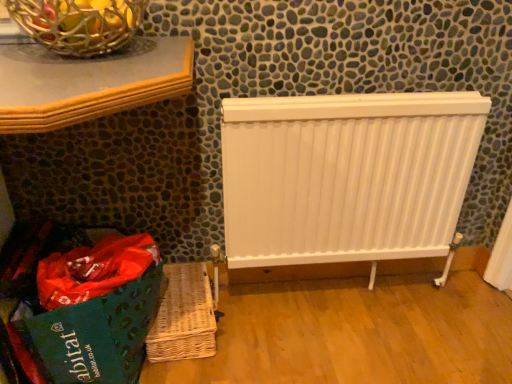
Question: Is woven brown basket at lower left looking in the opposite direction of white matte radiator at center?

Choices:
 (A) no
 (B) yes

Answer: (A)

Question: Can you confirm if woven brown basket at lower left is thinner than white matte radiator at center?

Choices:
 (A) no
 (B) yes

Answer: (A)

Question: Is woven brown basket at lower left next to white matte radiator at center?

Choices:
 (A) no
 (B) yes

Answer: (A)

Question: Is woven brown basket at lower left not close to white matte radiator at center?

Choices:
 (A) no
 (B) yes

Answer: (A)

Question: Is woven brown basket at lower left bigger than white matte radiator at center?

Choices:
 (A) yes
 (B) no

Answer: (B)

Question: Considering the positions of point (75, 18) and point (58, 337), is point (75, 18) closer or farther from the camera than point (58, 337)?

Choices:
 (A) farther
 (B) closer

Answer: (B)

Question: Is metallic wire basket at upper left to the left or to the right of green fabric shopping bag at lower left in the image?

Choices:
 (A) left
 (B) right

Answer: (B)

Question: From their relative heights in the image, would you say metallic wire basket at upper left is taller or shorter than green fabric shopping bag at lower left?

Choices:
 (A) tall
 (B) short

Answer: (B)

Question: Is metallic wire basket at upper left in front of or behind green fabric shopping bag at lower left in the image?

Choices:
 (A) behind
 (B) front

Answer: (B)

Question: From a real-world perspective, is woven brown basket at lower left positioned above or below metallic wire basket at upper left?

Choices:
 (A) below
 (B) above

Answer: (A)

Question: Relative to metallic wire basket at upper left, is woven brown basket at lower left in front or behind?

Choices:
 (A) front
 (B) behind

Answer: (B)

Question: Looking at their shapes, would you say woven brown basket at lower left is wider or thinner than metallic wire basket at upper left?

Choices:
 (A) thin
 (B) wide

Answer: (B)

Question: Considering the positions of woven brown basket at lower left and metallic wire basket at upper left in the image, is woven brown basket at lower left bigger or smaller than metallic wire basket at upper left?

Choices:
 (A) small
 (B) big

Answer: (A)

Question: In terms of height, does green fabric shopping bag at lower left look taller or shorter compared to metallic wire basket at upper left?

Choices:
 (A) short
 (B) tall

Answer: (B)

Question: Looking at their shapes, would you say green fabric shopping bag at lower left is wider or thinner than metallic wire basket at upper left?

Choices:
 (A) wide
 (B) thin

Answer: (A)